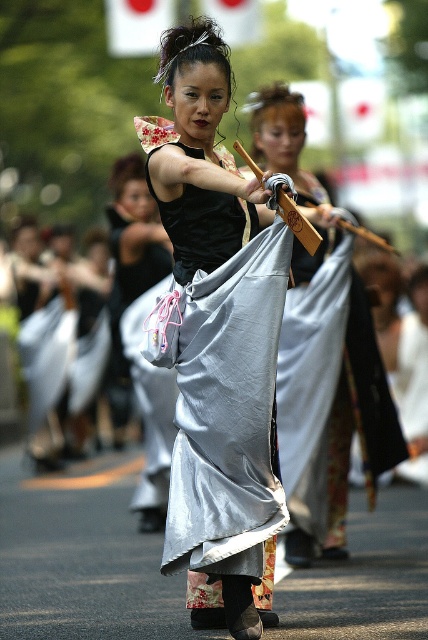
You are a costume designer preparing for a performance. You need to ensure that the silvery satin kimono at center and the silvery fabric skirt at center can be worn together without overlapping. Given their widths, which one should be placed closer to the body to avoid overlap?

The silvery fabric skirt at center has a smaller width than the silvery satin kimono at center. To avoid overlap, the silvery fabric skirt at center should be placed closer to the body, while the wider silvery satin kimono at center is worn over it.

You are a photographer positioned at the center of the scene. You want to take a photo that includes both the point at coordinates point (382,381) and point (127,244). However, you need to ensure that neither of these points is blocked by any part of the performer or the staff. Based on their spatial relationship, which point should you prioritize placing closer to the front of the frame to avoid obstruction?

Point (382,381) should be placed closer to the front of the frame because it is already in front of point (127,244). This positioning will help prevent the performer or staff from blocking it, as the closer point is less likely to be obscured by foreground elements.

You are a photographer trying to capture the main performer in the vibrant street performance. You notice the satin silver kimono at center and the silvery fabric skirt at center. Which one is closer to the camera?

The satin silver kimono at center is closer to the camera because it is in front of the silvery fabric skirt at center.